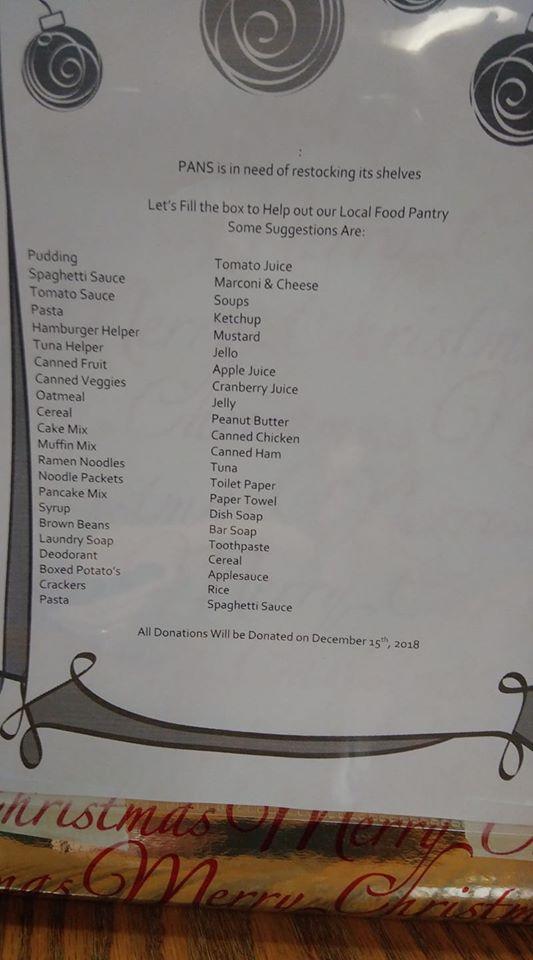
Identify the location of wooden tabletop. (37, 946).